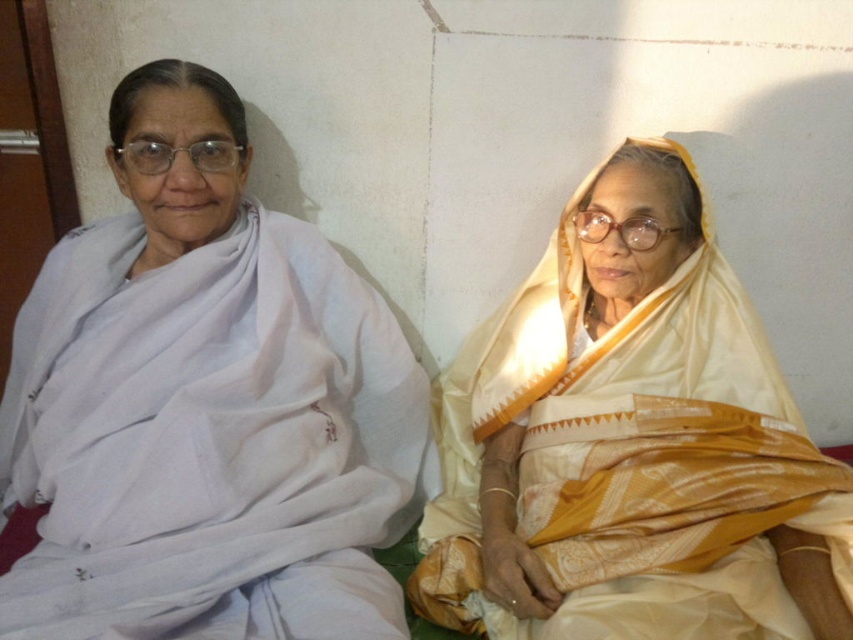
Can you confirm if white cotton sari at left is bigger than silky yellow sari at right?

Yes, white cotton sari at left is bigger than silky yellow sari at right.

Is white cotton sari at left smaller than silky yellow sari at right?

No.

Who is more forward, (230, 272) or (503, 412)?

Point (230, 272) is in front.

Where is `white cotton sari at left`? white cotton sari at left is located at coordinates (206, 404).